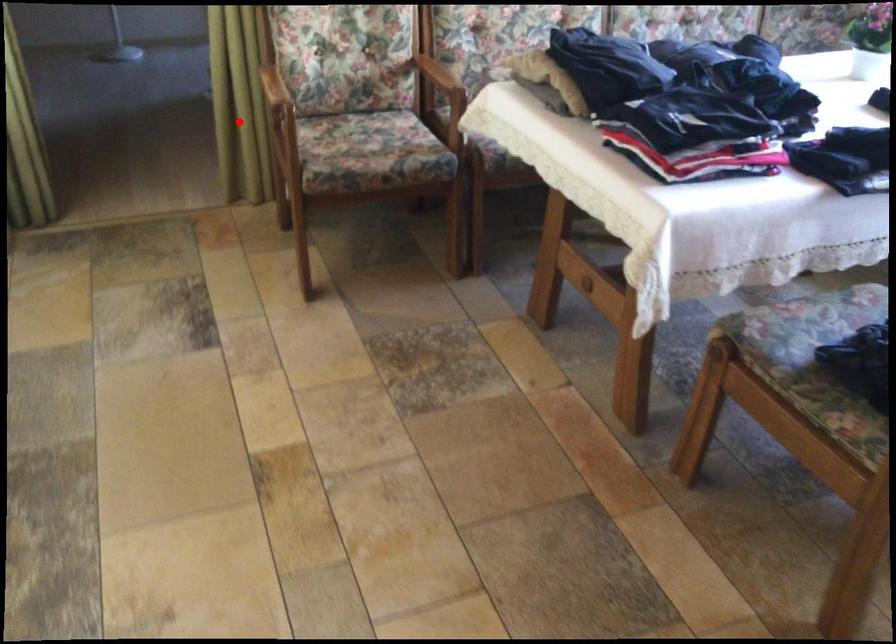
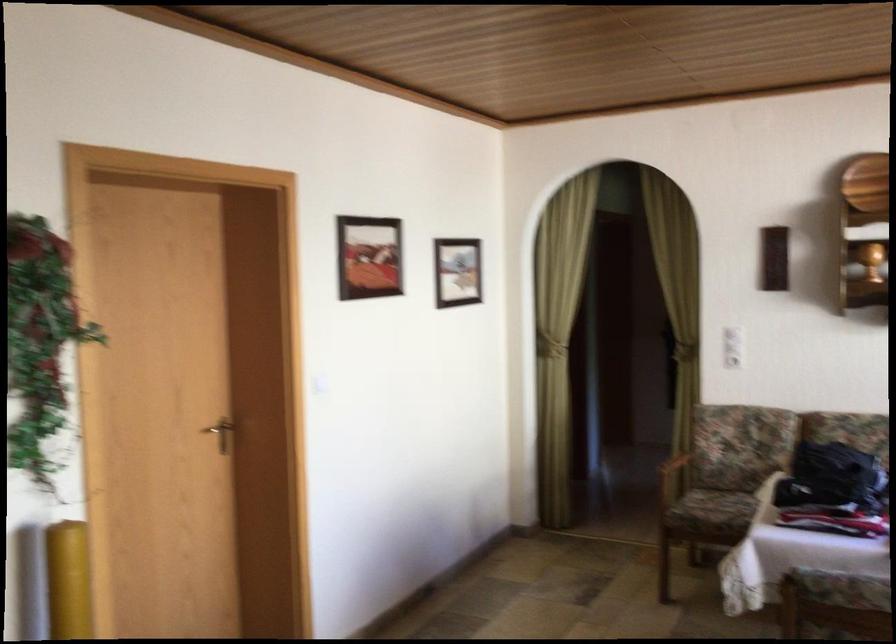
In the second image, find the point that corresponds to the highlighted location in the first image.

(672, 480)